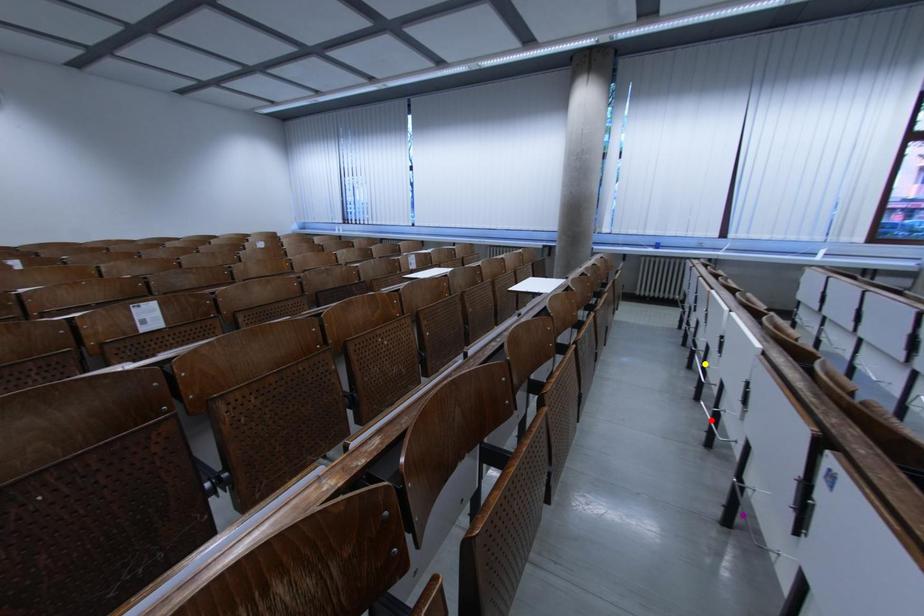
Order these from nearest to farthest:
purple point | yellow point | red point

yellow point → red point → purple point